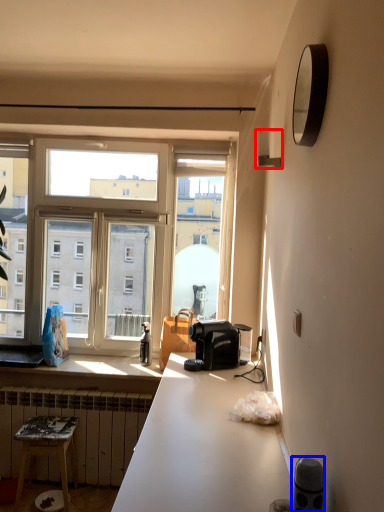
Question: Which object appears farthest to the camera in this image, lamp (highlighted by a red box) or appliance (highlighted by a blue box)?

Choices:
 (A) lamp
 (B) appliance

Answer: (A)